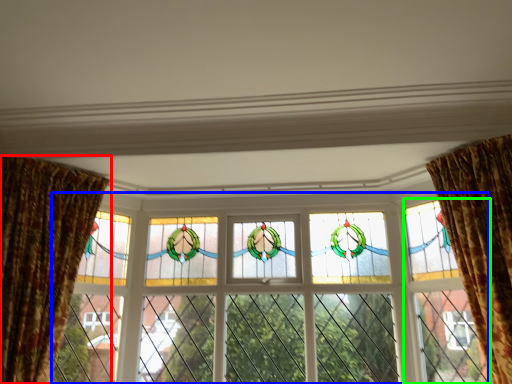
Question: Based on their relative distances, which object is nearer to curtain (highlighted by a red box)? Choose from window (highlighted by a blue box) and glass door (highlighted by a green box).

Choices:
 (A) window
 (B) glass door

Answer: (A)